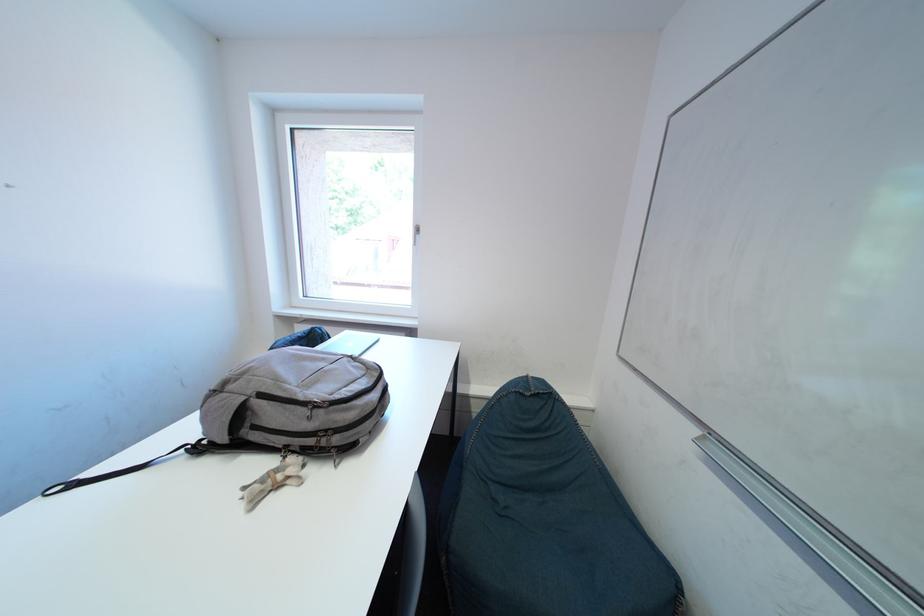
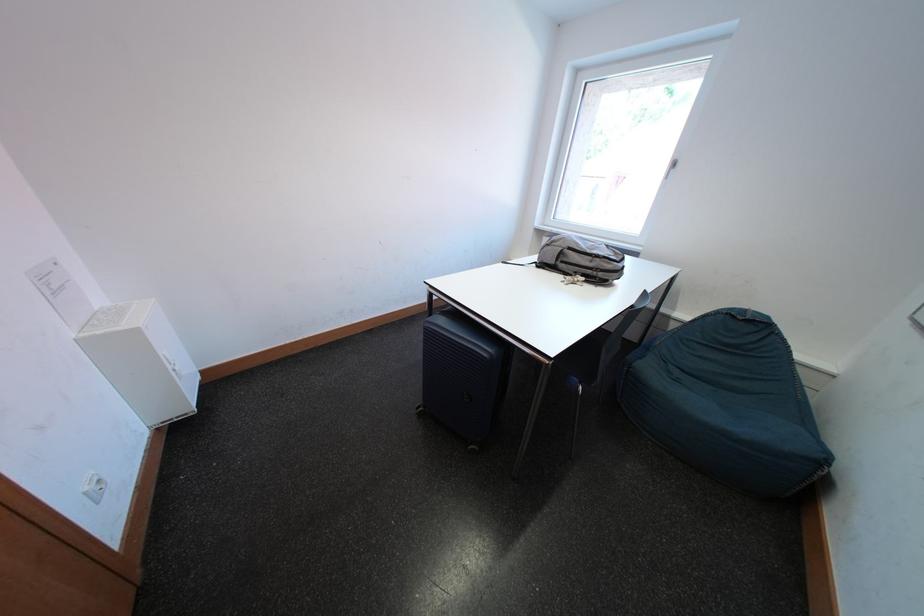
Where in the second image is the point corresponding to point 320,421 from the first image?

(601, 265)